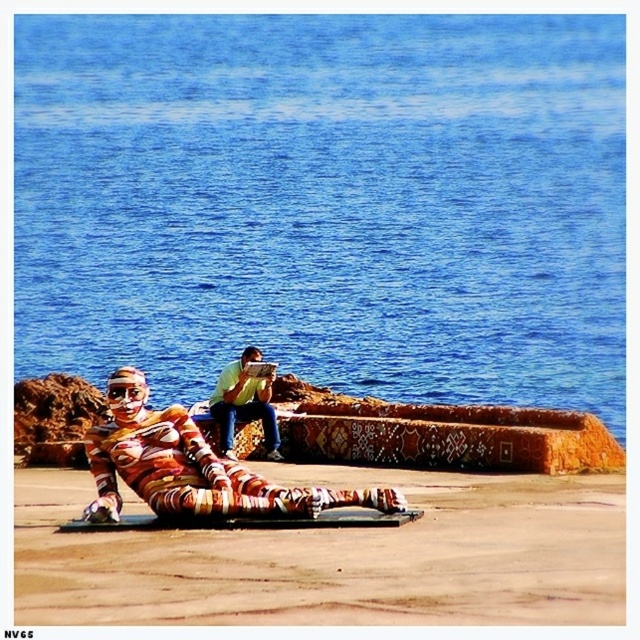
You are a photographer trying to capture the perfect shot of the multicolored fabric figure at lower center. According to the coordinates provided, where exactly should you position your camera to ensure the figure is centered in your frame?

The multicolored fabric figure at lower center is located at coordinates point (195,474), so you should position your camera directly facing that point to center it in your frame.

You are taking a photo of the scene and want to focus on both the person on the sandy surface and the seated individual on the metal structure. Which of the two points, point (100, 435) or point (248, 358), should you adjust your camera focus to ensure the person closer to the camera is in sharp focus?

Point (100, 435) should be focused on since it is closer to the camera than point (248, 358), ensuring the person on the sandy surface is in sharp focus.